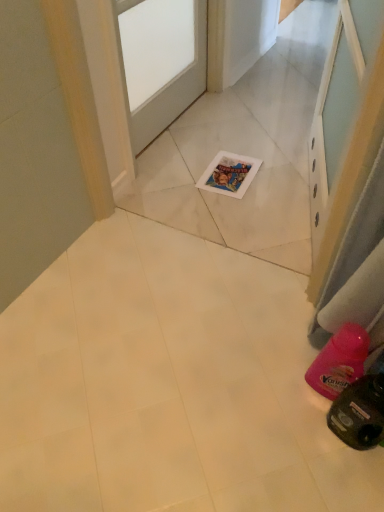
Where is `vacant space in white matte door at center (from a real-world perspective)`? Image resolution: width=384 pixels, height=512 pixels. vacant space in white matte door at center (from a real-world perspective) is located at coordinates (177, 133).